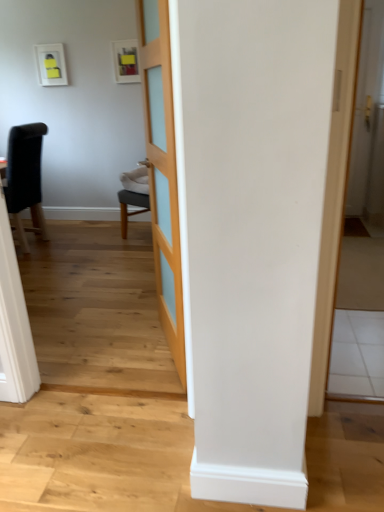
What do you see at coordinates (162, 170) in the screenshot? I see `light wood panelled door at center` at bounding box center [162, 170].

The image size is (384, 512). Identify the location of light wood panelled door at center. (162, 170).

Locate an element on the screen. light wood panelled door at center is located at coordinates (162, 170).